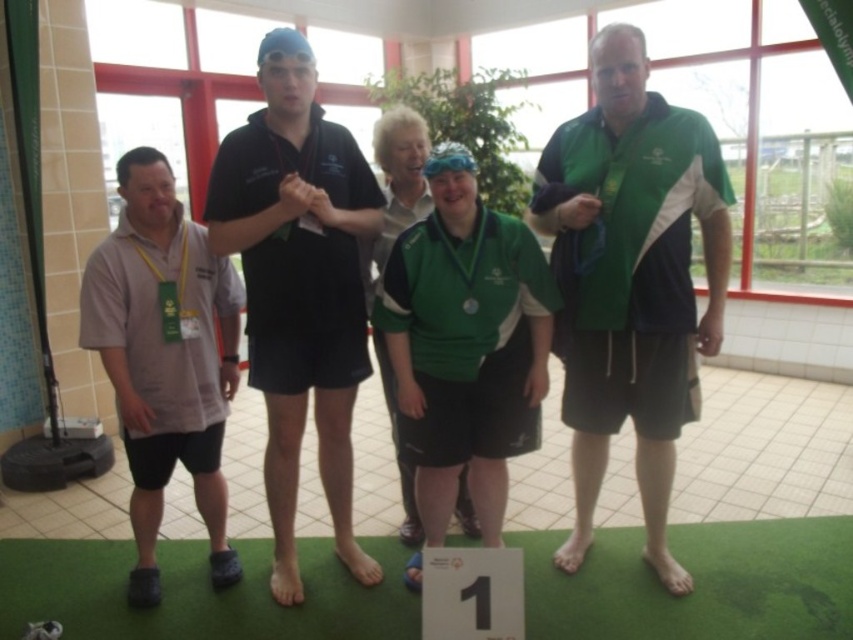
Question: Is green fabric shirt at center wider than gray fabric shirt at left?

Choices:
 (A) yes
 (B) no

Answer: (A)

Question: Is black matte shirt at center bigger than gray fabric shirt at left?

Choices:
 (A) no
 (B) yes

Answer: (B)

Question: Does green fabric shirt at center have a smaller size compared to black matte shirt at center?

Choices:
 (A) no
 (B) yes

Answer: (A)

Question: Which point is farther to the camera?

Choices:
 (A) (674, 371)
 (B) (277, 525)

Answer: (B)

Question: Which object appears closest to the camera in this image?

Choices:
 (A) black matte shirt at center
 (B) gray fabric shirt at left

Answer: (A)

Question: Which object appears farthest from the camera in this image?

Choices:
 (A) green fabric shirt at center
 (B) gray fabric shirt at left
 (C) black matte shirt at center

Answer: (B)